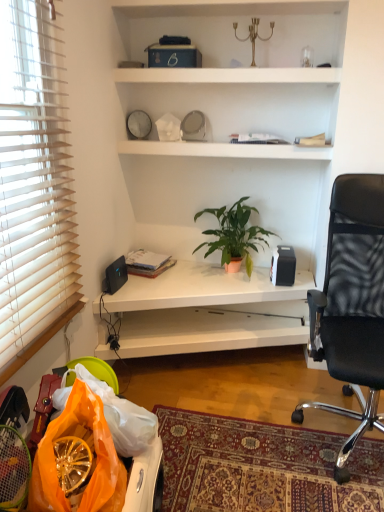
Locate an element on the screen. free spot to the right of black plastic speaker at lower left, the 1th loudspeaker when ordered from left to right is located at coordinates (136, 286).